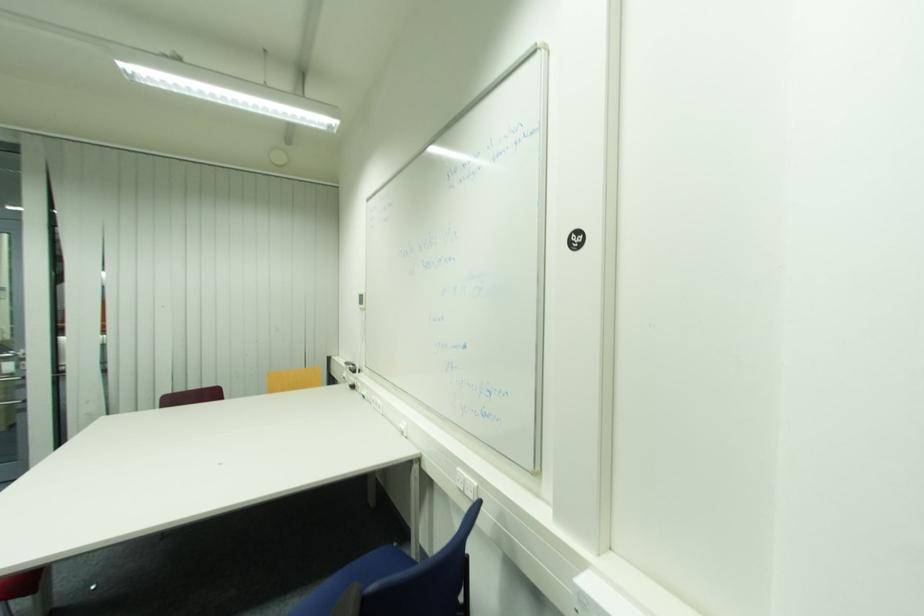
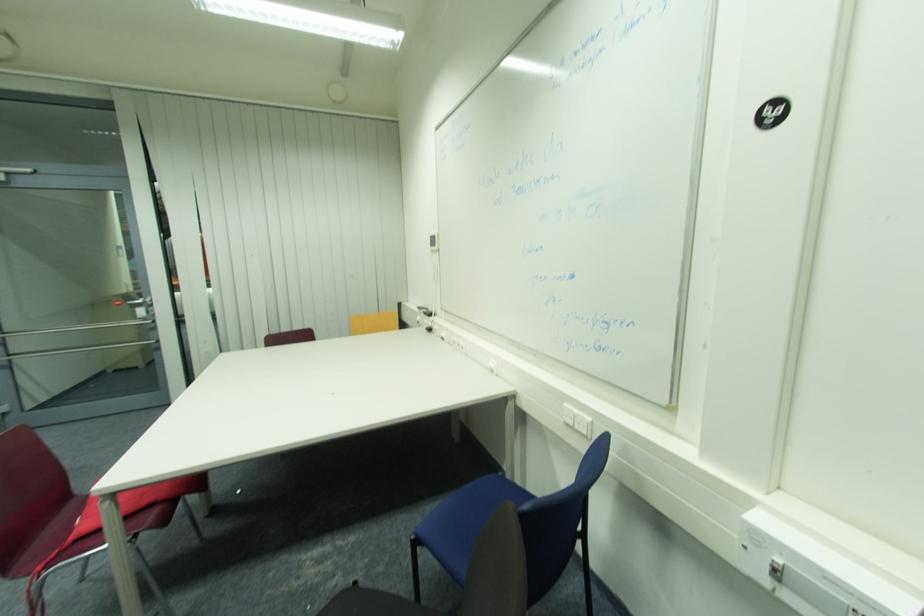
In a continuous first-person perspective shot, in which direction is the camera moving?

The movement direction of the cameraman is left, forward.